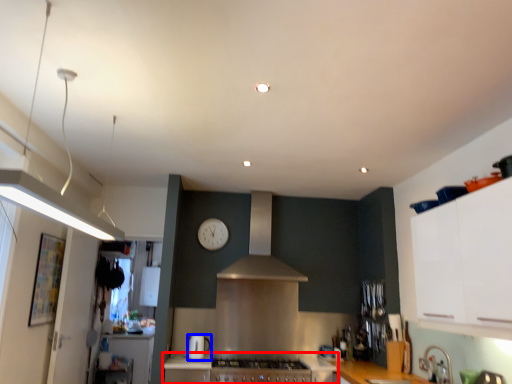
Question: Which of the following is the farthest to the observer, countertop (highlighted by a red box) or kitchen appliance (highlighted by a blue box)?

Choices:
 (A) countertop
 (B) kitchen appliance

Answer: (B)